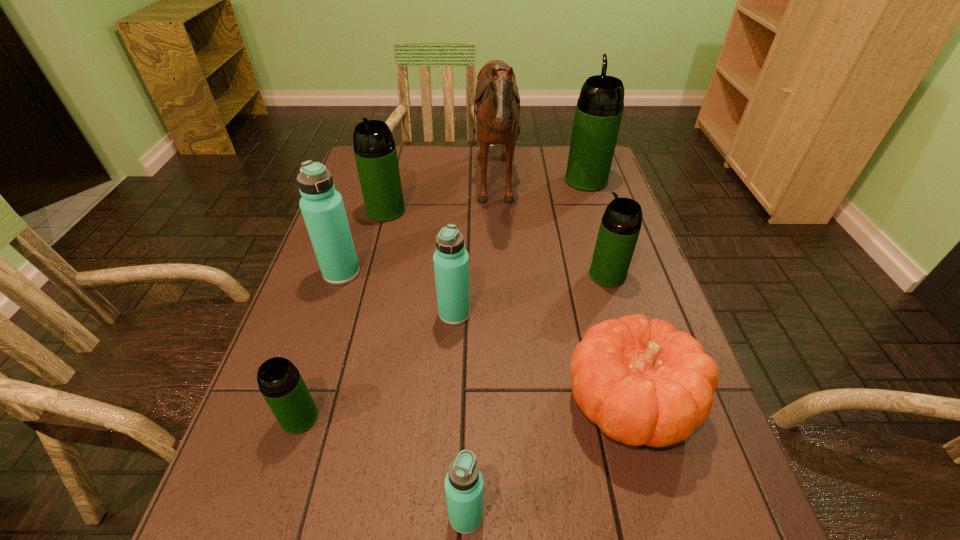
Find the location of a particular element. The height and width of the screenshot is (540, 960). the second smallest green thermos bottle is located at coordinates (620, 226).

Where is `the nearest green thermos bottle`? This screenshot has width=960, height=540. the nearest green thermos bottle is located at coordinates (281, 384).

At what (x,y) coordinates should I click in order to perform the action: click on the second nearest thermos bottle. Please return your answer as a coordinate pair (x, y). This screenshot has height=540, width=960. Looking at the image, I should click on (281, 384).

The width and height of the screenshot is (960, 540). I want to click on the nearest aqua thermos bottle, so click(463, 483).

Identify the location of the nearest object. This screenshot has width=960, height=540. (463, 483).

The image size is (960, 540). Find the location of `orange pumpkin`. orange pumpkin is located at coordinates (641, 382).

Locate an element on the screen. The width and height of the screenshot is (960, 540). vacant space located 0.380m on the back of the brown saddle is located at coordinates (349, 190).

This screenshot has height=540, width=960. I want to click on vacant area situated 0.260m on the back of the brown saddle, so click(x=388, y=190).

The height and width of the screenshot is (540, 960). I want to click on vacant space located 0.070m on the back of the brown saddle, so click(450, 190).

I want to click on blank space located 0.080m from the spout of the tallest thermos bottle, so click(579, 157).